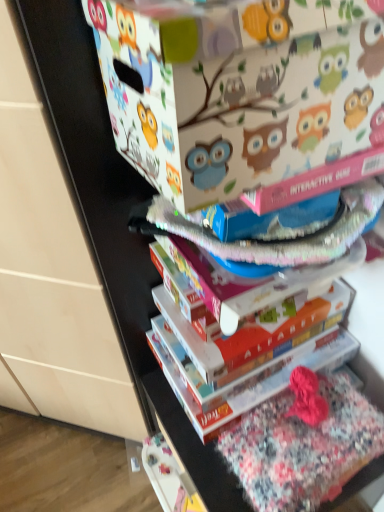
Question: Would you say matte white cardboard box at upper center is to the left or to the right of floral cotton fabric at lower right in the picture?

Choices:
 (A) right
 (B) left

Answer: (B)

Question: From their relative heights in the image, would you say matte white cardboard box at upper center is taller or shorter than floral cotton fabric at lower right?

Choices:
 (A) short
 (B) tall

Answer: (B)

Question: Considering the real-world distances, which object is closest to the hardcover book at center?

Choices:
 (A) matte white cardboard box at upper center
 (B) floral cotton fabric at lower right

Answer: (B)

Question: Which is farther from the matte white cardboard box at upper center?

Choices:
 (A) floral cotton fabric at lower right
 (B) hardcover book at center

Answer: (A)